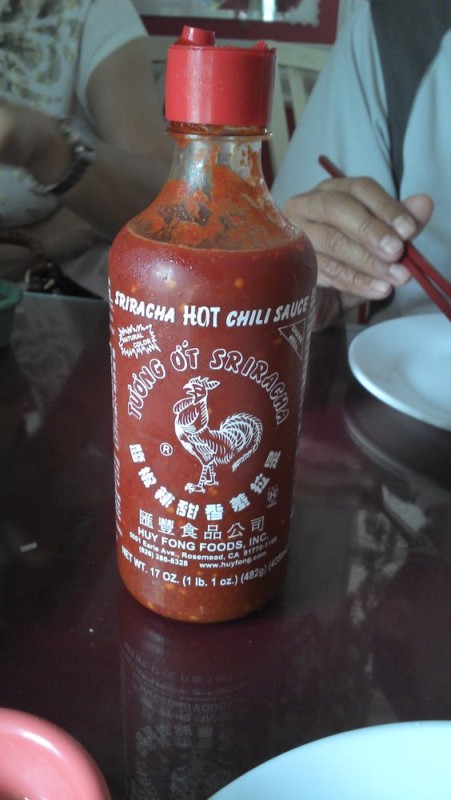
This screenshot has width=451, height=800. Find the location of `wall`. wall is located at coordinates (240, 22).